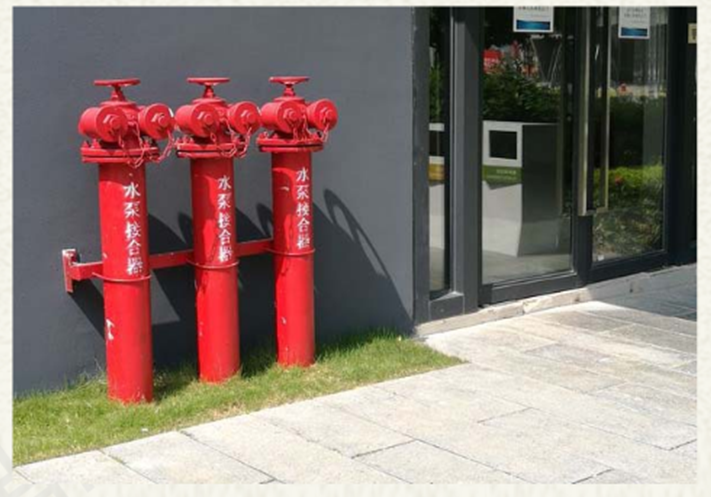
Locate an element on the screen. The height and width of the screenshot is (497, 711). door handles is located at coordinates (584, 128), (606, 120).